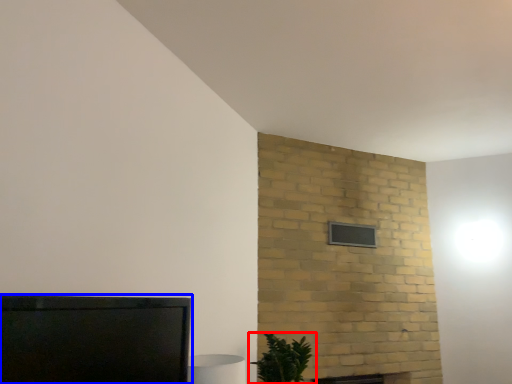
Question: Which object is closer to the camera taking this photo, houseplant (highlighted by a red box) or furniture (highlighted by a blue box)?

Choices:
 (A) houseplant
 (B) furniture

Answer: (B)